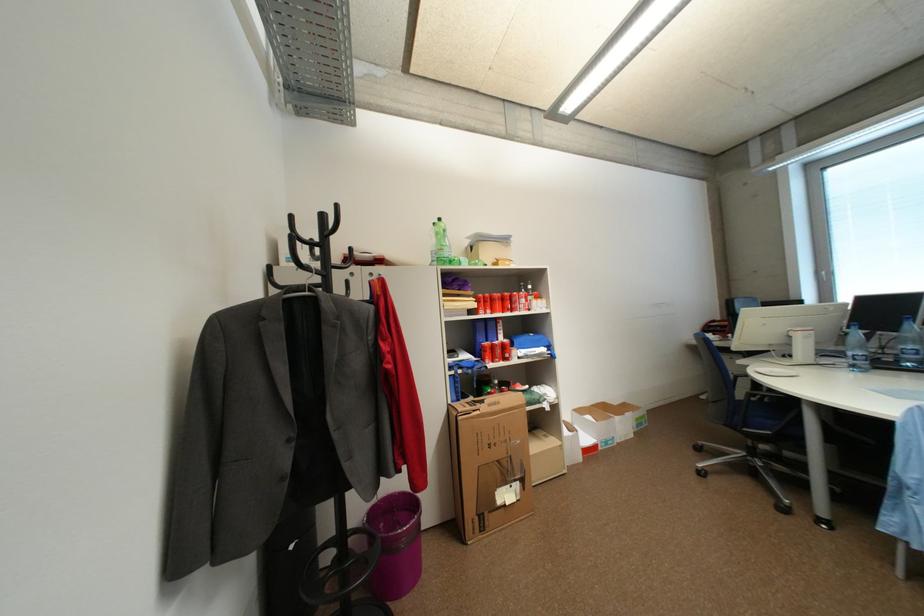
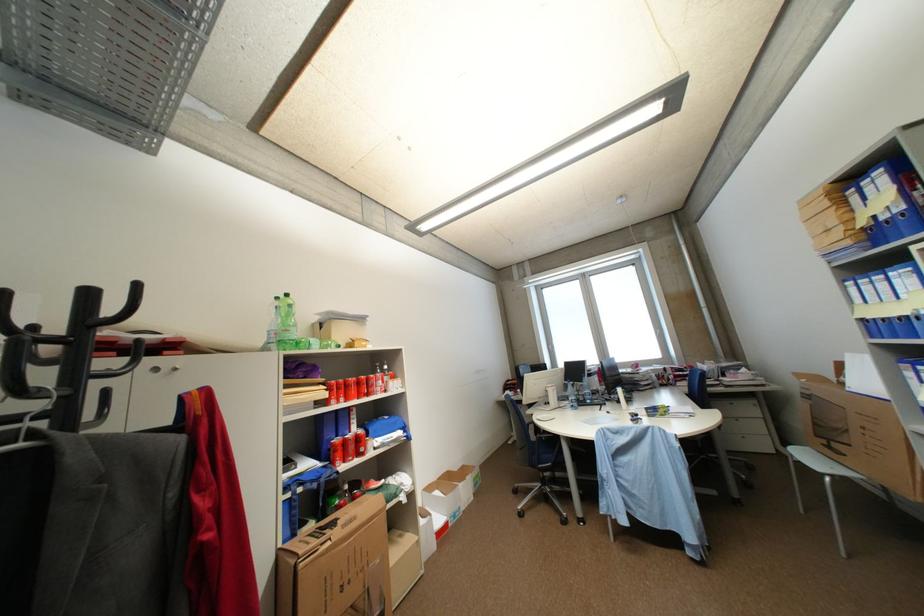
Find the pixel in the second image that matches pixel 473 265 in the first image.

(323, 349)